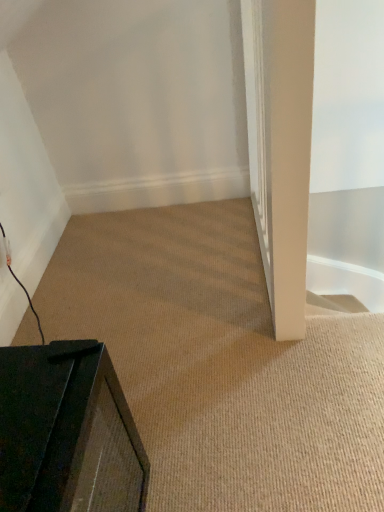
Question: Considering the relative positions of white smooth pillar at right and black matte speaker at lower left in the image provided, is white smooth pillar at right to the left or to the right of black matte speaker at lower left?

Choices:
 (A) left
 (B) right

Answer: (B)

Question: From a real-world perspective, is white smooth pillar at right physically located above or below black matte speaker at lower left?

Choices:
 (A) above
 (B) below

Answer: (A)

Question: Which of these objects is positioned farthest from the black matte tv at lower left?

Choices:
 (A) white smooth pillar at right
 (B) black matte speaker at lower left

Answer: (A)

Question: Based on their relative distances, which object is nearer to the black matte speaker at lower left?

Choices:
 (A) black matte tv at lower left
 (B) white smooth pillar at right

Answer: (A)